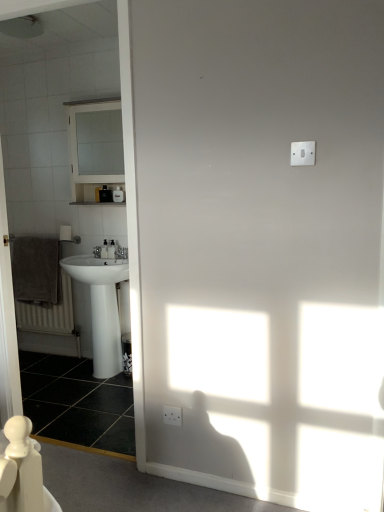
Question: Is brown textured towel at left further to the viewer compared to white glossy sink at left?

Choices:
 (A) no
 (B) yes

Answer: (B)

Question: Are brown textured towel at left and white glossy sink at left beside each other?

Choices:
 (A) no
 (B) yes

Answer: (A)

Question: From the image's perspective, is brown textured towel at left on top of white glossy sink at left?

Choices:
 (A) no
 (B) yes

Answer: (A)

Question: From a real-world perspective, does brown textured towel at left sit lower than white glossy sink at left?

Choices:
 (A) yes
 (B) no

Answer: (A)

Question: Considering the relative sizes of brown textured towel at left and white glossy sink at left in the image provided, is brown textured towel at left bigger than white glossy sink at left?

Choices:
 (A) no
 (B) yes

Answer: (A)

Question: Looking at their shapes, would you say brown textured towel at left is wider or thinner than black glossy tile at lower left?

Choices:
 (A) wide
 (B) thin

Answer: (B)

Question: From a real-world perspective, is brown textured towel at left positioned above or below black glossy tile at lower left?

Choices:
 (A) below
 (B) above

Answer: (B)

Question: Looking at the image, does brown textured towel at left seem bigger or smaller compared to black glossy tile at lower left?

Choices:
 (A) small
 (B) big

Answer: (A)

Question: Is point (61, 316) closer or farther from the camera than point (99, 395)?

Choices:
 (A) closer
 (B) farther

Answer: (B)

Question: Would you say black glossy tile at lower left is to the left or to the right of brown textured towel at left in the picture?

Choices:
 (A) left
 (B) right

Answer: (B)

Question: Is point (46, 414) closer or farther from the camera than point (69, 301)?

Choices:
 (A) farther
 (B) closer

Answer: (B)

Question: Which is correct: black glossy tile at lower left is inside brown textured towel at left, or outside of it?

Choices:
 (A) outside
 (B) inside

Answer: (A)

Question: From the image's perspective, is black glossy tile at lower left positioned above or below brown textured towel at left?

Choices:
 (A) below
 (B) above

Answer: (A)

Question: Looking at their shapes, would you say brown textured towel at left is wider or thinner than white glossy sink at left?

Choices:
 (A) wide
 (B) thin

Answer: (B)

Question: Is brown textured towel at left taller or shorter than white glossy sink at left?

Choices:
 (A) short
 (B) tall

Answer: (A)